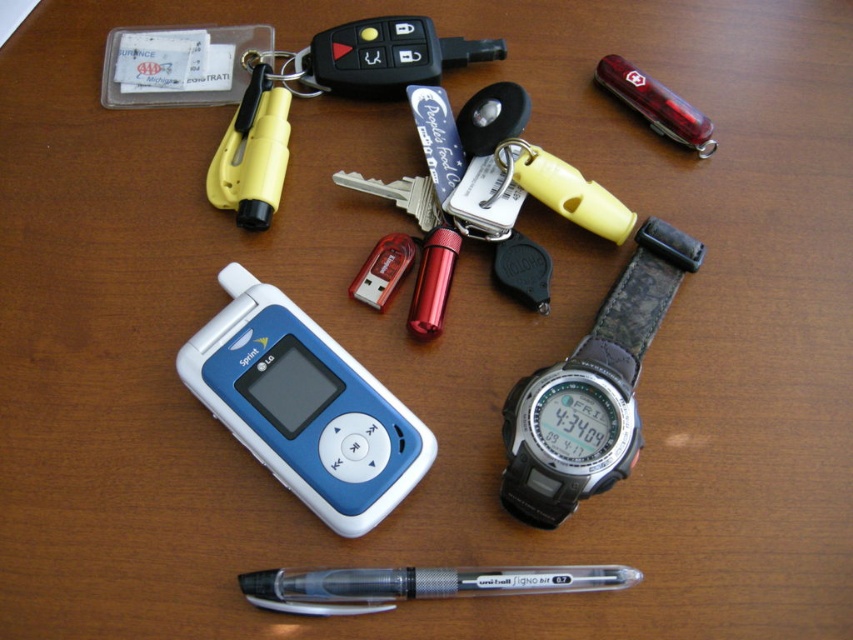
You are organizing items on a desk and need to place a new item between the blue plastic phone at center and the yellow plastic keychain at upper center. Where should you place the new item relative to these two objects?

The blue plastic phone at center is located below the yellow plastic keychain at upper center, so you should place the new item between them by positioning it above the phone and below the keychain.

You are looking at the arrangement of items on the wooden surface. Where is the yellow plastic keychain at upper center located in terms of its 2D coordinates?

The yellow plastic keychain at upper center is located at the 2D coordinates of point (322, 93).